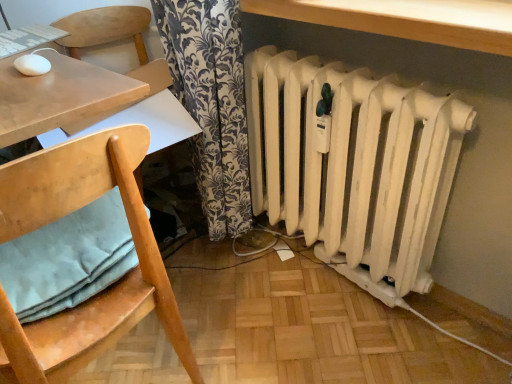
The width and height of the screenshot is (512, 384). What do you see at coordinates (353, 165) in the screenshot?
I see `white matte radiator at lower right` at bounding box center [353, 165].

Based on the photo, what is the approximate height of wooden table at upper center?

wooden table at upper center is 2.84 inches tall.

This screenshot has width=512, height=384. What do you see at coordinates (406, 19) in the screenshot?
I see `wooden table at upper center` at bounding box center [406, 19].

What do you see at coordinates (68, 259) in the screenshot? The height and width of the screenshot is (384, 512). I see `light blue fabric pillow at lower left` at bounding box center [68, 259].

The height and width of the screenshot is (384, 512). Find the location of `light blue fabric pillow at lower left`. light blue fabric pillow at lower left is located at coordinates (68, 259).

Where is `white matte radiator at lower right`? The image size is (512, 384). white matte radiator at lower right is located at coordinates (353, 165).

Between white matte radiator at lower right and wooden chair with cushion at left, which one has smaller size?

With smaller size is white matte radiator at lower right.

Can you confirm if white matte radiator at lower right is thinner than wooden chair with cushion at left?

Indeed, white matte radiator at lower right has a lesser width compared to wooden chair with cushion at left.

From their relative heights in the image, would you say white matte radiator at lower right is taller or shorter than wooden chair with cushion at left?

In the image, white matte radiator at lower right appears to be shorter than wooden chair with cushion at left.

From the image's perspective, relative to wooden chair with cushion at left, is white matte radiator at lower right above or below?

white matte radiator at lower right is above wooden chair with cushion at left.

Looking at this image, from the image's perspective, which is below, wooden table at upper center or white matte radiator at lower right?

white matte radiator at lower right, from the image's perspective.

Would you say wooden table at upper center is to the left or to the right of white matte radiator at lower right in the picture?

In the image, wooden table at upper center appears on the left side of white matte radiator at lower right.

Is wooden table at upper center next to white matte radiator at lower right and touching it?

No, wooden table at upper center is not next to white matte radiator at lower right.

Find the location of a particular element. table that is above the white matte radiator at lower right (from the image's perspective) is located at coordinates (406, 19).

The height and width of the screenshot is (384, 512). Find the location of `chair that is below the light blue fabric pillow at lower left (from the image's perspective)`. chair that is below the light blue fabric pillow at lower left (from the image's perspective) is located at coordinates (102, 292).

Is light blue fabric pillow at lower left in front of or behind wooden chair with cushion at left in the image?

Visually, light blue fabric pillow at lower left is located behind wooden chair with cushion at left.

In the scene shown: Which of these two, light blue fabric pillow at lower left or wooden chair with cushion at left, is smaller?

Smaller between the two is light blue fabric pillow at lower left.

Can you see light blue fabric pillow at lower left touching wooden chair with cushion at left?

Absolutely, light blue fabric pillow at lower left is next to and touching wooden chair with cushion at left.

From a real-world perspective, is white matte radiator at lower right located beneath light blue fabric pillow at lower left?

Yes, from a real-world perspective, white matte radiator at lower right is under light blue fabric pillow at lower left.

Could you tell me if white matte radiator at lower right is turned towards light blue fabric pillow at lower left?

Yes, white matte radiator at lower right is facing light blue fabric pillow at lower left.

Can you confirm if white matte radiator at lower right is shorter than light blue fabric pillow at lower left?

In fact, white matte radiator at lower right may be taller than light blue fabric pillow at lower left.

Considering the relative positions of light blue fabric pillow at lower left and wooden table at upper center in the image provided, is light blue fabric pillow at lower left to the left of wooden table at upper center from the viewer's perspective?

Yes.

From the image's perspective, is light blue fabric pillow at lower left beneath wooden table at upper center?

Yes, from the image's perspective, light blue fabric pillow at lower left is below wooden table at upper center.

Considering the relative sizes of light blue fabric pillow at lower left and wooden table at upper center in the image provided, is light blue fabric pillow at lower left smaller than wooden table at upper center?

Yes.

Are wooden table at upper center and light blue fabric pillow at lower left beside each other?

wooden table at upper center is not next to light blue fabric pillow at lower left, and they're not touching.

Does wooden table at upper center turn towards light blue fabric pillow at lower left?

No, wooden table at upper center is not facing towards light blue fabric pillow at lower left.

Can you confirm if wooden table at upper center is smaller than light blue fabric pillow at lower left?

Actually, wooden table at upper center might be larger than light blue fabric pillow at lower left.

Looking at this image, choose the correct answer: Is wooden table at upper center inside light blue fabric pillow at lower left or outside it?

wooden table at upper center cannot be found inside light blue fabric pillow at lower left.

Between light blue fabric pillow at lower left and white matte radiator at lower right, which one has larger size?

Bigger between the two is white matte radiator at lower right.

Is light blue fabric pillow at lower left looking in the opposite direction of white matte radiator at lower right?

No, white matte radiator at lower right is not at the back of light blue fabric pillow at lower left.

From a real-world perspective, is light blue fabric pillow at lower left positioned above or below white matte radiator at lower right?

From a real-world perspective, light blue fabric pillow at lower left is physically above white matte radiator at lower right.

From the image's perspective, is light blue fabric pillow at lower left under white matte radiator at lower right?

Yes, from the image's perspective, light blue fabric pillow at lower left is below white matte radiator at lower right.

You are a GUI agent. You are given a task and a screenshot of the screen. Output one action in this format:
    pyautogui.click(x=<x>, y=<y>)
    Task: Click on the radiator beneath the wooden chair with cushion at left (from a real-world perspective)
    Image resolution: width=512 pixels, height=384 pixels.
    Given the screenshot: What is the action you would take?
    pyautogui.click(x=353, y=165)

Where is `table on the left of white matte radiator at lower right`? table on the left of white matte radiator at lower right is located at coordinates (406, 19).

Considering their positions, is white matte radiator at lower right positioned closer to wooden chair with cushion at left than light blue fabric pillow at lower left?

The object closer to wooden chair with cushion at left is light blue fabric pillow at lower left.

When comparing their distances from wooden table at upper center, does light blue fabric pillow at lower left or wooden chair with cushion at left seem closer?

The object closer to wooden table at upper center is wooden chair with cushion at left.

Based on their spatial positions, is wooden table at upper center or white matte radiator at lower right further from light blue fabric pillow at lower left?

wooden table at upper center is positioned further to the anchor light blue fabric pillow at lower left.

Estimate the real-world distances between objects in this image. Which object is further from white matte radiator at lower right, wooden table at upper center or light blue fabric pillow at lower left?

light blue fabric pillow at lower left is positioned further to the anchor white matte radiator at lower right.

Looking at the image, which one is located further to wooden table at upper center, white matte radiator at lower right or light blue fabric pillow at lower left?

Result: light blue fabric pillow at lower left is further to wooden table at upper center.

Considering their positions, is wooden table at upper center positioned closer to wooden chair with cushion at left than light blue fabric pillow at lower left?

Based on the image, light blue fabric pillow at lower left appears to be nearer to wooden chair with cushion at left.

Based on their spatial positions, is light blue fabric pillow at lower left or wooden table at upper center further from white matte radiator at lower right?

Based on the image, light blue fabric pillow at lower left appears to be further to white matte radiator at lower right.

Considering their positions, is wooden table at upper center positioned further to light blue fabric pillow at lower left than wooden chair with cushion at left?

The object further to light blue fabric pillow at lower left is wooden table at upper center.

This screenshot has width=512, height=384. I want to click on radiator between wooden table at upper center and wooden chair with cushion at left from top to bottom, so click(353, 165).

The width and height of the screenshot is (512, 384). What are the coordinates of `pillow between wooden table at upper center and wooden chair with cushion at left from top to bottom` in the screenshot? It's located at (68, 259).

Locate an element on the screen. The width and height of the screenshot is (512, 384). table between light blue fabric pillow at lower left and white matte radiator at lower right from left to right is located at coordinates (406, 19).

This screenshot has height=384, width=512. In order to click on pillow located between wooden chair with cushion at left and white matte radiator at lower right in the left-right direction in this screenshot , I will do `click(68, 259)`.